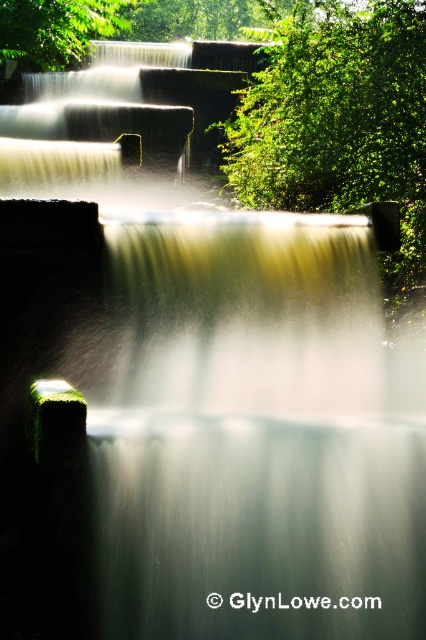
Question: Which point appears farthest from the camera in this image?

Choices:
 (A) (23, 22)
 (B) (304, 1)

Answer: (B)

Question: Which object appears closest to the camera in this image?

Choices:
 (A) green leafy tree at upper center
 (B) green leafy tree at upper left

Answer: (A)

Question: Which of the following is the closest to the observer?

Choices:
 (A) green leafy tree at upper left
 (B) green leafy tree at upper center

Answer: (B)

Question: Does green leafy tree at upper center lie behind green leafy tree at upper left?

Choices:
 (A) yes
 (B) no

Answer: (B)

Question: Is the position of green leafy tree at upper center more distant than that of green leafy tree at upper left?

Choices:
 (A) no
 (B) yes

Answer: (A)

Question: Does green leafy tree at upper center appear on the left side of green leafy tree at upper left?

Choices:
 (A) yes
 (B) no

Answer: (B)